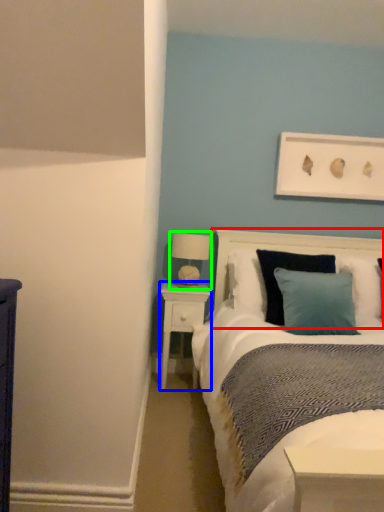
Question: Which object is positioned farthest from headboard (highlighted by a red box)? Select from nightstand (highlighted by a blue box) and table lamp (highlighted by a green box).

Choices:
 (A) nightstand
 (B) table lamp

Answer: (A)